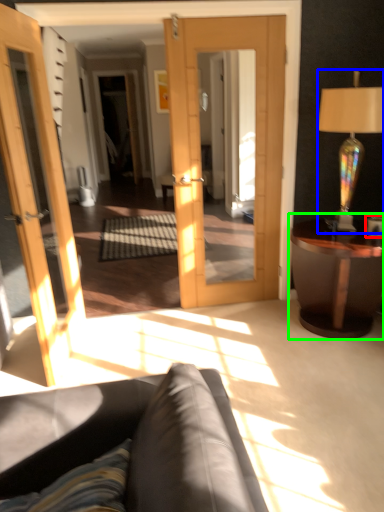
Question: Considering the real-world distances, which object is closest to coffee cup (highlighted by a red box)? lamp (highlighted by a blue box) or table (highlighted by a green box).

Choices:
 (A) lamp
 (B) table

Answer: (B)